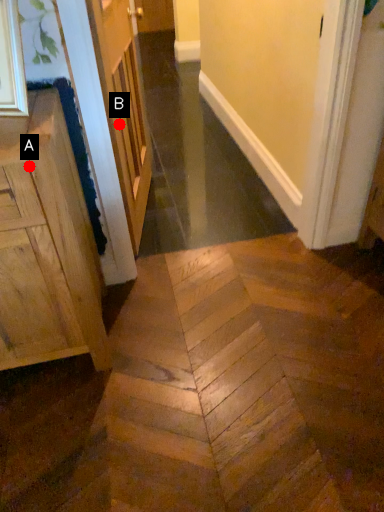
Question: Two points are circled on the image, labeled by A and B beside each circle. Which point is farther from the camera taking this photo?

Choices:
 (A) A is further
 (B) B is further

Answer: (B)